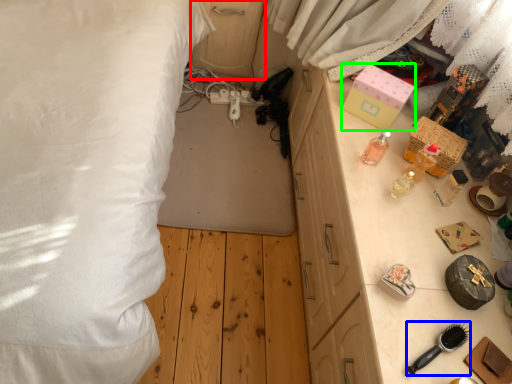
Question: Considering the real-world distances, which object is farthest from dresser (highlighted by a red box)? brush (highlighted by a blue box) or box (highlighted by a green box)?

Choices:
 (A) brush
 (B) box

Answer: (A)